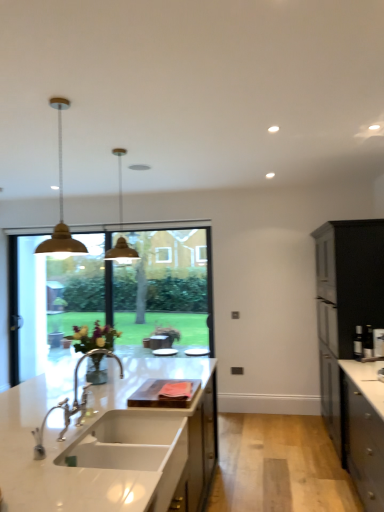
What is the approximate width of white marble countertop at center?

1.37 meters.

What do you see at coordinates (108, 442) in the screenshot?
I see `white marble countertop at center` at bounding box center [108, 442].

Image resolution: width=384 pixels, height=512 pixels. What are the coordinates of `metallic gold pendant light at center` in the screenshot? It's located at point(122,253).

Is white marble countertop at center positioned with its back to black matte cabinet at right?

Absolutely, white marble countertop at center is directed away from black matte cabinet at right.

Which object is wider, white marble countertop at center or black matte cabinet at right?

With larger width is white marble countertop at center.

How different are the orientations of white marble countertop at center and black matte cabinet at right in degrees?

They differ by 0.516 degrees in their facing directions.

At what (x,y) coordinates should I click in order to perform the action: click on countertop lying in front of the metallic gold pendant light at center. Please return your answer as a coordinate pair (x, y). The image size is (384, 512). Looking at the image, I should click on (108, 442).

From the image's perspective, would you say white marble countertop at center is positioned over metallic gold pendant light at center?

No, from the image's perspective, white marble countertop at center is not over metallic gold pendant light at center.

Who is more distant, white marble countertop at center or metallic gold pendant light at center?

metallic gold pendant light at center.

From a real-world perspective, is white marble countertop at center located beneath metallic gold pendant light at center?

Indeed, from a real-world perspective, white marble countertop at center is positioned beneath metallic gold pendant light at center.

Looking at this image, considering the relative positions of metallic gold pendant light at center and chrome metallic faucet at sink left in the image provided, is metallic gold pendant light at center to the right of chrome metallic faucet at sink left from the viewer's perspective?

No.

Would you say chrome metallic faucet at sink left is part of metallic gold pendant light at center's contents?

No, chrome metallic faucet at sink left is not inside metallic gold pendant light at center.

Can you confirm if metallic gold pendant light at center is bigger than chrome metallic faucet at sink left?

Yes, metallic gold pendant light at center is bigger than chrome metallic faucet at sink left.

From the image's perspective, does metallic gold pendant light at center appear higher than chrome metallic faucet at sink left?

Correct, metallic gold pendant light at center appears higher than chrome metallic faucet at sink left in the image.

Who is taller, chrome metallic faucet at sink left or metallic gold pendant light at center?

metallic gold pendant light at center.

Does chrome metallic faucet at sink left touch metallic gold pendant light at center?

A: No, chrome metallic faucet at sink left is not with metallic gold pendant light at center.

Where is `tap on the right of metallic gold pendant light at center`? Image resolution: width=384 pixels, height=512 pixels. tap on the right of metallic gold pendant light at center is located at coordinates (73, 403).

Considering their positions, is white glossy sink at center located in front of or behind chrome metallic faucet at sink left?

white glossy sink at center is in front of chrome metallic faucet at sink left.

From the image's perspective, which is above, white glossy sink at center or chrome metallic faucet at sink left?

chrome metallic faucet at sink left appears higher in the image.

Can you confirm if white glossy sink at center is taller than chrome metallic faucet at sink left?

In fact, white glossy sink at center may be shorter than chrome metallic faucet at sink left.

Which is behind, point (69, 245) or point (121, 252)?

Point (69, 245)

Does gold matte pendant light at upper left contain metallic gold pendant light at center?

No, metallic gold pendant light at center is not surrounded by gold matte pendant light at upper left.

What's the angular difference between gold matte pendant light at upper left and metallic gold pendant light at center's facing directions?

They differ by 0.00179 degrees in their facing directions.

From the image's perspective, which is below, gold matte pendant light at upper left or metallic gold pendant light at center?

From the image's view, metallic gold pendant light at center is below.

Considering the relative sizes of chrome metallic faucet at sink left and gold matte pendant light at upper left in the image provided, is chrome metallic faucet at sink left shorter than gold matte pendant light at upper left?

Yes.

Is chrome metallic faucet at sink left positioned with its back to gold matte pendant light at upper left?

chrome metallic faucet at sink left is not turned away from gold matte pendant light at upper left.

Can you confirm if chrome metallic faucet at sink left is thinner than gold matte pendant light at upper left?

Indeed, chrome metallic faucet at sink left has a lesser width compared to gold matte pendant light at upper left.

Which is behind, point (123, 374) or point (63, 238)?

The point (63, 238) is farther from the camera.

This screenshot has height=512, width=384. In order to click on cabinetry to the right of white marble countertop at center in this screenshot , I will do `click(351, 347)`.

Identify the location of light fixture above the white marble countertop at center (from a real-world perspective). (122, 253).

Estimate the real-world distances between objects in this image. Which object is closer to white marble countertop at center, white glossy sink at center or black matte cabinet at right?

Among the two, white glossy sink at center is located nearer to white marble countertop at center.

Considering their positions, is white glossy sink at center positioned further to black matte cabinet at right than chrome metallic faucet at sink left?

chrome metallic faucet at sink left lies further to black matte cabinet at right than the other object.

Estimate the real-world distances between objects in this image. Which object is further from white glossy sink at center, black matte cabinet at right or gold matte pendant light at upper left?

The object further to white glossy sink at center is gold matte pendant light at upper left.

Looking at the image, which one is located further to white marble countertop at center, metallic gold pendant light at center or white glossy sink at center?

Among the two, metallic gold pendant light at center is located further to white marble countertop at center.

Estimate the real-world distances between objects in this image. Which object is further from metallic gold pendant light at center, white glossy sink at center or chrome metallic faucet at sink left?

The object further to metallic gold pendant light at center is white glossy sink at center.

Based on their spatial positions, is gold matte pendant light at upper left or white marble countertop at center further from chrome metallic faucet at sink left?

Among the two, gold matte pendant light at upper left is located further to chrome metallic faucet at sink left.

Which object lies nearer to the anchor point black matte cabinet at right, metallic gold pendant light at center or chrome metallic faucet at sink left?

chrome metallic faucet at sink left lies closer to black matte cabinet at right than the other object.

Based on their spatial positions, is black matte cabinet at right or white glossy sink at center further from white marble countertop at center?

black matte cabinet at right lies further to white marble countertop at center than the other object.

Where is `tap between gold matte pendant light at upper left and white marble countertop at center from top to bottom`? Image resolution: width=384 pixels, height=512 pixels. tap between gold matte pendant light at upper left and white marble countertop at center from top to bottom is located at coordinates (73, 403).

Find the location of a particular element. This screenshot has width=384, height=512. sink between chrome metallic faucet at sink left and white marble countertop at center vertically is located at coordinates click(x=126, y=441).

At what (x,y) coordinates should I click in order to perform the action: click on countertop between gold matte pendant light at upper left and black matte cabinet at right in the horizontal direction. Please return your answer as a coordinate pair (x, y). Image resolution: width=384 pixels, height=512 pixels. Looking at the image, I should click on (108, 442).

Where is `tap located between gold matte pendant light at upper left and black matte cabinet at right in the left-right direction`? tap located between gold matte pendant light at upper left and black matte cabinet at right in the left-right direction is located at coordinates (73, 403).